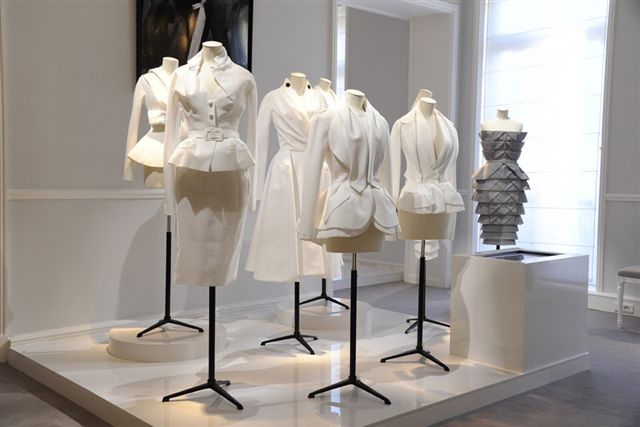
The image size is (640, 427). Find the location of `chair`. chair is located at coordinates (619, 288).